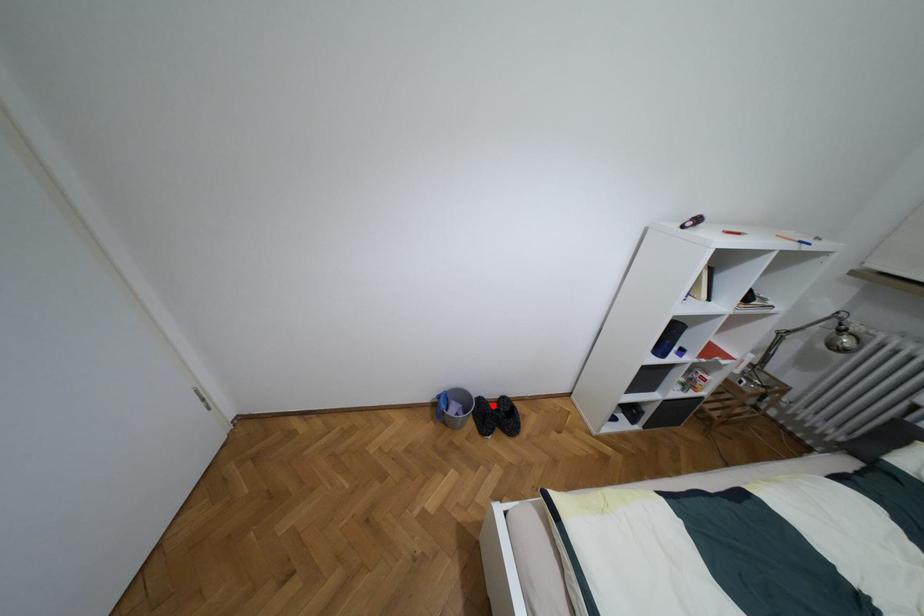
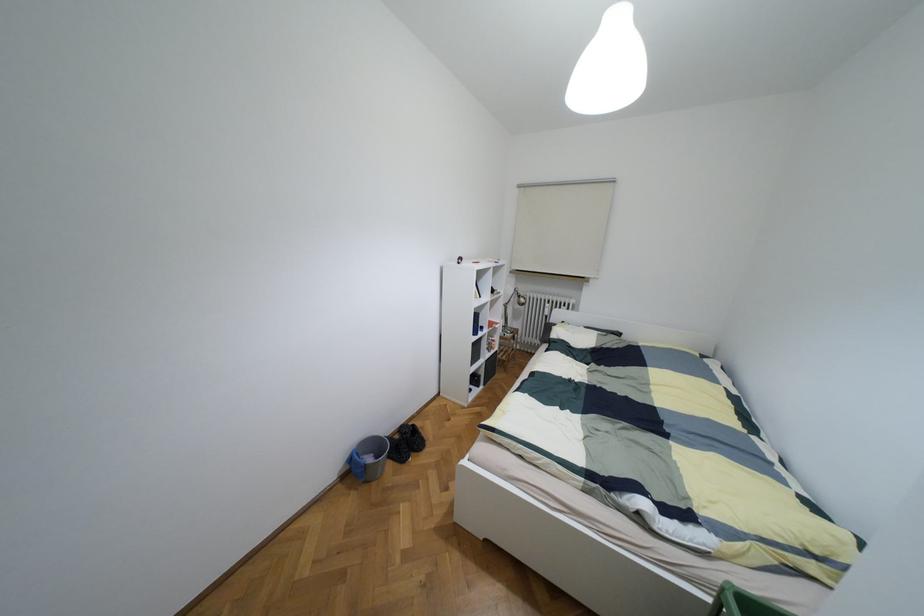
Question: I am providing you with two images of the same scene from different viewpoints. Image1 has a red point marked. In image2, the corresponding 3D location appears at what relative position? Reply with the corresponding letter.

Choices:
 (A) Closer
 (B) Farther

Answer: (A)